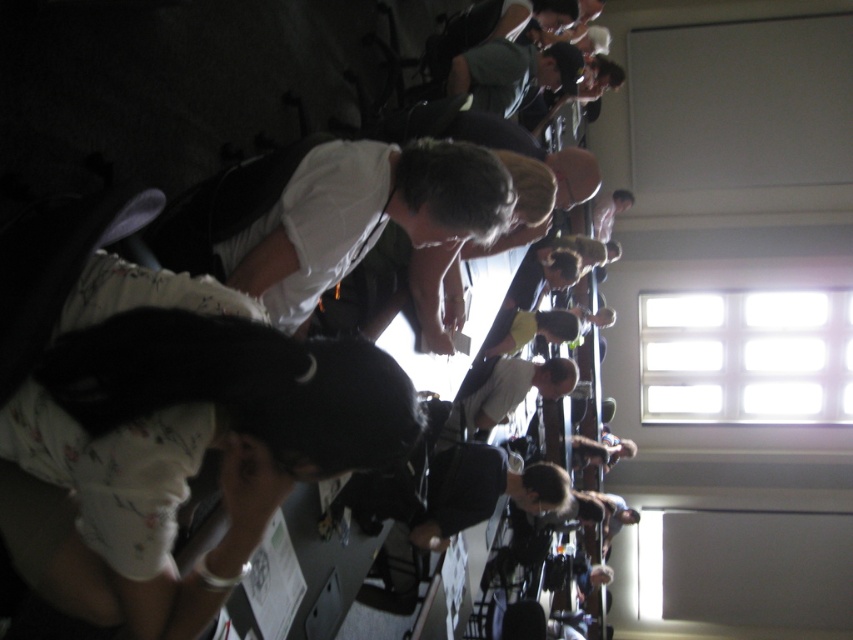
You are standing in the room and want to find the white matte shirt at center. Based on the coordinates provided, where should you look?

The white matte shirt at center is located at coordinates point (328, 214).

You are a photographer in this scene and want to capture a clear shot of the light brown leather jacket at center without the white matte shirt at center blocking it. What adjustment should you make to your camera angle?

The white matte shirt at center is positioned over the light brown leather jacket at center, so you should lower your camera angle to avoid the obstruction caused by the shirt.